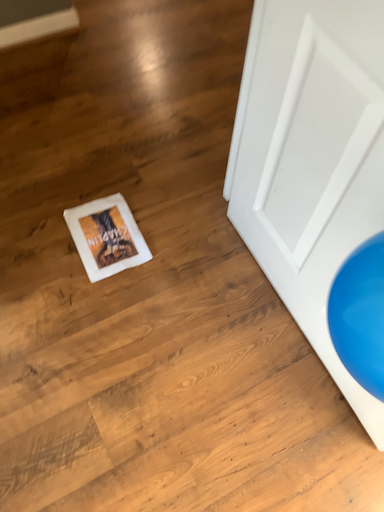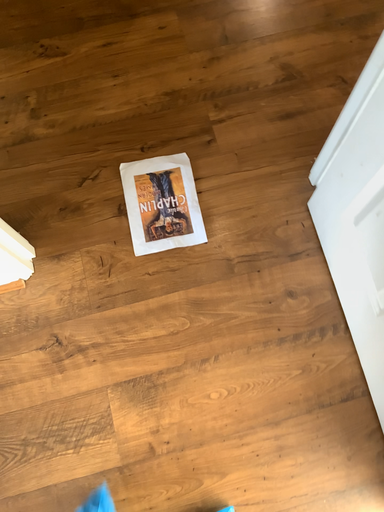
Question: How did the camera likely rotate when shooting the video?

Choices:
 (A) rotated upward
 (B) rotated downward

Answer: (B)